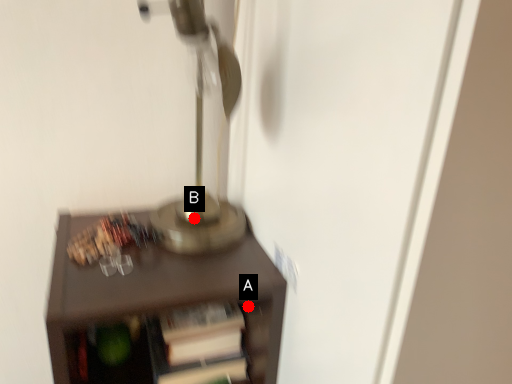
Question: Two points are circled on the image, labeled by A and B beside each circle. Among these points, which one is farthest from the camera?

Choices:
 (A) A is further
 (B) B is further

Answer: (B)